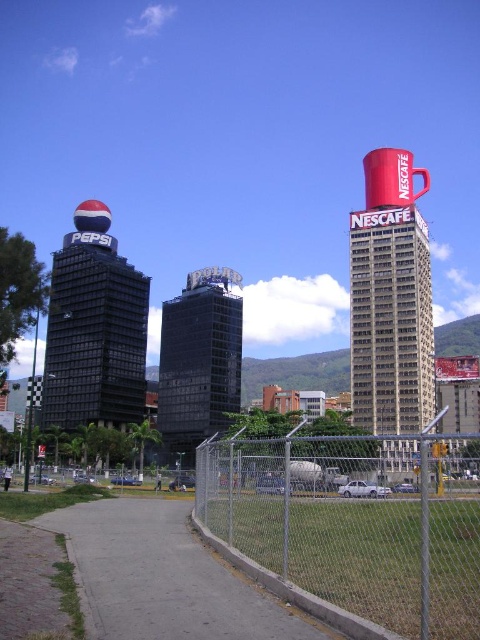
You are a GUI agent. You are given a task and a screenshot of the screen. Output one action in this format:
    pyautogui.click(x=<x>, y=<y>)
    Task: Click on the gray concrete pavement at lower left
    
    Given the screenshot: What is the action you would take?
    pyautogui.click(x=165, y=577)

Is point (129, 580) closer to camera compared to point (400, 344)?

Yes, point (129, 580) is in front of point (400, 344).

Measure the distance between point (135, 547) and camera.

A distance of 109.35 feet exists between point (135, 547) and camera.

At what (x,y) coordinates should I click in order to perform the action: click on gray concrete pavement at lower left. Please return your answer as a coordinate pair (x, y). This screenshot has height=640, width=480. Looking at the image, I should click on (165, 577).

Between point (257, 529) and point (78, 355), which one is positioned in front?

Point (257, 529) is more forward.

Measure the distance between silver chain-link fence at lower center and camera.

silver chain-link fence at lower center and camera are 20.32 meters apart from each other.

This screenshot has height=640, width=480. What are the coordinates of `silver chain-link fence at lower center` in the screenshot? It's located at tap(356, 522).

Between silver chain-link fence at lower center and red ceramic cup at upper center, which one appears on the left side from the viewer's perspective?

silver chain-link fence at lower center is more to the left.

Does silver chain-link fence at lower center appear over red ceramic cup at upper center?

Incorrect, silver chain-link fence at lower center is not positioned above red ceramic cup at upper center.

At what (x,y) coordinates should I click in order to perform the action: click on silver chain-link fence at lower center. Please return your answer as a coordinate pair (x, y). The height and width of the screenshot is (640, 480). Looking at the image, I should click on (356, 522).